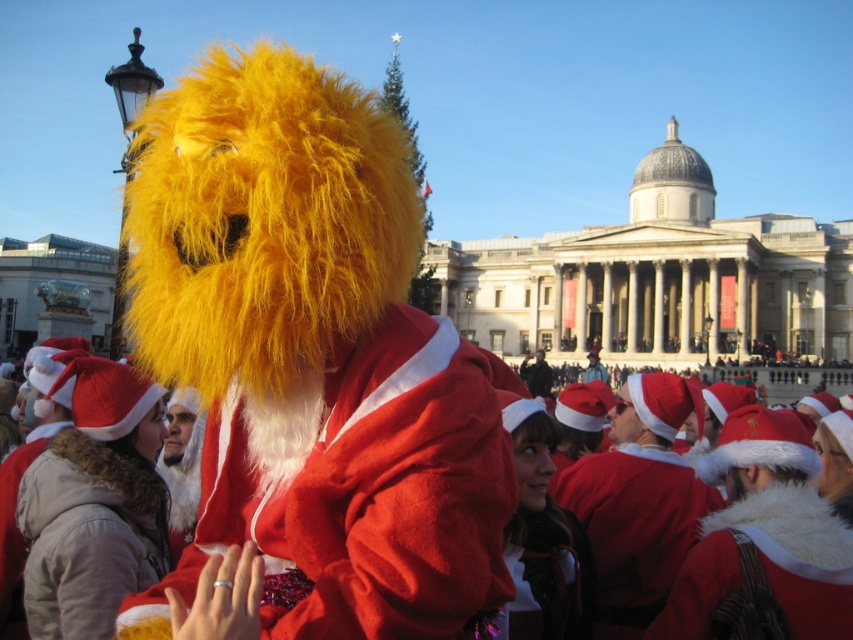
You are a costume designer preparing for a Christmas parade. You have two items at the center of your design layout. One is the fuzzy yellow mask at center and the other is the black fuzzy hat at center. Based on their sizes, which one might be more suitable for a tall character to wear?

The fuzzy yellow mask at center has a greater height compared to the black fuzzy hat at center, making it more suitable for a tall character to wear as it can accommodate their height better.

You are a photographer trying to capture a clear photo of the fuzzy red santa suit at center and the black fuzzy hat at center. Which one will appear closer to the camera in the photo?

The fuzzy red santa suit at center will appear closer to the camera in the photo because it is positioned in front of the black fuzzy hat at center.

You are organizing a photo shoot and need to ensure that the fuzzy red santa suit at center and the black fuzzy hat at center are positioned so that the hat doesn not block the face of the person wearing it. Given their sizes, is this possible?

The fuzzy red santa suit at center might be wider than black fuzzy hat at center, so positioning the hat so it doesn not block the face is possible as long as the hat is placed appropriately on the head.